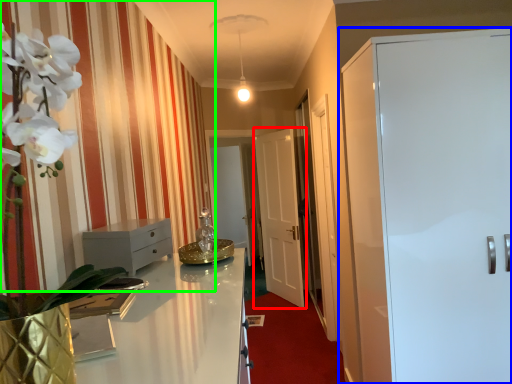
Question: Based on their relative distances, which object is farther from door (highlighted by a red box)? Choose from door (highlighted by a blue box) and curtain (highlighted by a green box).

Choices:
 (A) door
 (B) curtain

Answer: (A)